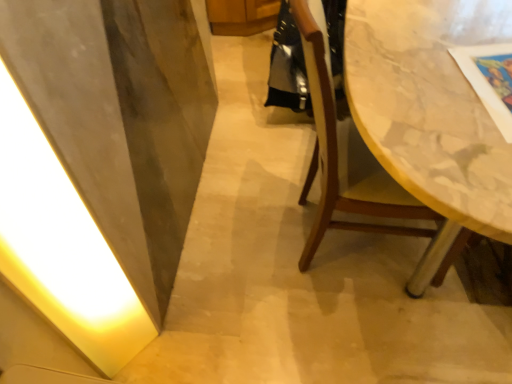
Where is `shiny black robe at center`? shiny black robe at center is located at coordinates (287, 66).

I want to click on shiny black robe at center, so (x=287, y=66).

Measure the distance between shiny black robe at center and white glossy light at left.

shiny black robe at center and white glossy light at left are 1.19 meters apart.

Which is behind, shiny black robe at center or white glossy light at left?

shiny black robe at center is more distant.

Is shiny black robe at center beside white glossy light at left?

shiny black robe at center and white glossy light at left are clearly separated.

How different are the orientations of shiny black robe at center and white glossy light at left in degrees?

They differ by 64.5 degrees in their facing directions.

Is white glossy light at left looking in the opposite direction of wooden chair at right?

No, white glossy light at left is not facing the opposite direction of wooden chair at right.

Who is bigger, white glossy light at left or wooden chair at right?

wooden chair at right is bigger.

Is white glossy light at left with wooden chair at right?

white glossy light at left and wooden chair at right are not in contact.

In the scene shown: From a real-world perspective, which is physically above, white glossy light at left or wooden chair at right?

From a 3D spatial view, white glossy light at left is above.

Does point (322, 146) appear closer or farther from the camera than point (96, 279)?

Clearly, point (322, 146) is more distant from the camera than point (96, 279).

Is wooden chair at right surrounding white glossy light at left?

No, white glossy light at left is located outside of wooden chair at right.

From their relative heights in the image, would you say wooden chair at right is taller or shorter than white glossy light at left?

Considering their sizes, wooden chair at right has less height than white glossy light at left.

How much distance is there between wooden chair at right and white glossy light at left?

wooden chair at right and white glossy light at left are 28.39 inches apart from each other.

Can you confirm if white glossy light at left is smaller than shiny black robe at center?

Yes.

Is white glossy light at left turned away from shiny black robe at center?

white glossy light at left does not have its back to shiny black robe at center.

Considering the relative positions of white glossy light at left and shiny black robe at center in the image provided, is white glossy light at left to the left or to the right of shiny black robe at center?

white glossy light at left is positioned on shiny black robe at center's left side.

Is point (5, 69) positioned in front of point (292, 75)?

Yes, point (5, 69) is closer to viewer.

Is shiny black robe at center shorter than wooden chair at right?

Yes.

Which object is more forward, shiny black robe at center or wooden chair at right?

wooden chair at right is in front.

Is shiny black robe at center next to wooden chair at right?

shiny black robe at center is not next to wooden chair at right, and they're not touching.

From the image's perspective, which is above, shiny black robe at center or wooden chair at right?

From the image's view, shiny black robe at center is above.

Would you say wooden chair at right is a long distance from shiny black robe at center?

wooden chair at right is actually quite close to shiny black robe at center.

From the picture: Considering the sizes of wooden chair at right and shiny black robe at center in the image, is wooden chair at right wider or thinner than shiny black robe at center?

Considering their sizes, wooden chair at right looks broader than shiny black robe at center.

From the image's perspective, who appears lower, wooden chair at right or shiny black robe at center?

wooden chair at right appears lower in the image.

Locate an element on the screen. Image resolution: width=512 pixels, height=384 pixels. light in front of the shiny black robe at center is located at coordinates (61, 245).

Where is `chair below the white glossy light at left (from a real-world perspective)`? The image size is (512, 384). chair below the white glossy light at left (from a real-world perspective) is located at coordinates (364, 179).

From the image, which object appears to be nearer to white glossy light at left, wooden chair at right or shiny black robe at center?

wooden chair at right.

Estimate the real-world distances between objects in this image. Which object is closer to shiny black robe at center, white glossy light at left or wooden chair at right?

wooden chair at right lies closer to shiny black robe at center than the other object.

From the picture: From the image, which object appears to be nearer to white glossy light at left, shiny black robe at center or wooden chair at right?

wooden chair at right is closer to white glossy light at left.

When comparing their distances from wooden chair at right, does white glossy light at left or shiny black robe at center seem closer?

shiny black robe at center is closer to wooden chair at right.

Considering their positions, is shiny black robe at center positioned closer to wooden chair at right than white glossy light at left?

Based on the image, shiny black robe at center appears to be nearer to wooden chair at right.

From the image, which object appears to be nearer to shiny black robe at center, wooden chair at right or white glossy light at left?

wooden chair at right is positioned closer to the anchor shiny black robe at center.

Identify the location of chair located between white glossy light at left and shiny black robe at center in the depth direction. (364, 179).